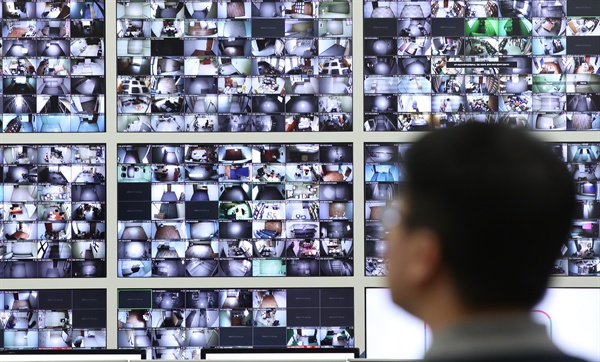
This screenshot has width=600, height=362. I want to click on screen without security camera footage being played, so click(390, 333), click(281, 357), click(100, 359).